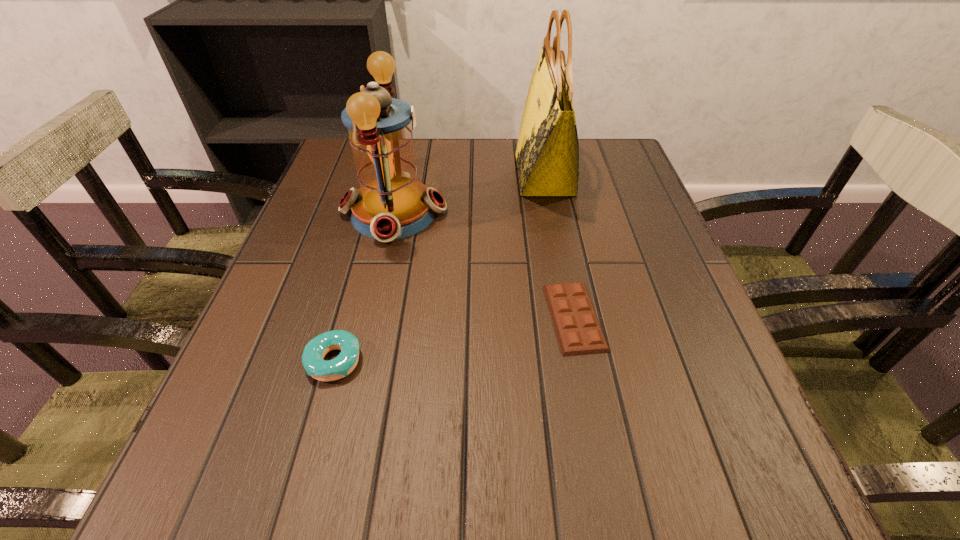
In order to click on free space that is in between the shortest object and the second tallest object in this screenshot , I will do `click(484, 265)`.

At what (x,y) coordinates should I click in order to perform the action: click on the second closest object relative to the lantern. Please return your answer as a coordinate pair (x, y). This screenshot has height=540, width=960. Looking at the image, I should click on (578, 330).

Locate which object is the second closest to the second tallest object. Please provide its 2D coordinates. Your answer should be formatted as a tuple, i.e. [(x, y)], where the tuple contains the x and y coordinates of a point satisfying the conditions above.

[(578, 330)]

Where is `free point that satisfies the following two spatial constraints: 1. on the front-facing side of the lantern; 2. on the back side of the chocolate bar`? The height and width of the screenshot is (540, 960). free point that satisfies the following two spatial constraints: 1. on the front-facing side of the lantern; 2. on the back side of the chocolate bar is located at coordinates (370, 317).

Where is `vacant point that satisfies the following two spatial constraints: 1. on the front-facing side of the chocolate bar; 2. on the left side of the lantern`? This screenshot has width=960, height=540. vacant point that satisfies the following two spatial constraints: 1. on the front-facing side of the chocolate bar; 2. on the left side of the lantern is located at coordinates (370, 317).

Where is `vacant space that satisfies the following two spatial constraints: 1. on the back side of the shortest object; 2. on the front-facing side of the tote bag`? The image size is (960, 540). vacant space that satisfies the following two spatial constraints: 1. on the back side of the shortest object; 2. on the front-facing side of the tote bag is located at coordinates (546, 174).

The width and height of the screenshot is (960, 540). I want to click on free space that satisfies the following two spatial constraints: 1. on the front-facing side of the shortest object; 2. on the left side of the tote bag, so click(x=572, y=317).

Image resolution: width=960 pixels, height=540 pixels. I want to click on free point that satisfies the following two spatial constraints: 1. on the front-facing side of the shortest object; 2. on the left side of the lantern, so click(370, 317).

Locate an element on the screen. free space that satisfies the following two spatial constraints: 1. on the front-facing side of the tallest object; 2. on the back side of the chocolate bar is located at coordinates (572, 317).